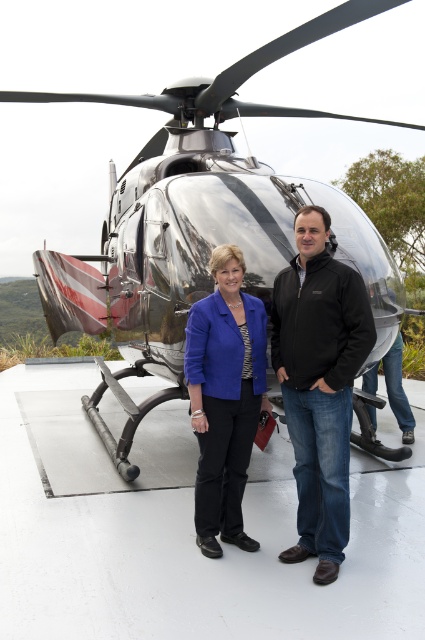
Question: Is black matte jacket at center positioned before matte blue blazer at center?

Choices:
 (A) no
 (B) yes

Answer: (B)

Question: Is black matte jacket at center closer to the viewer compared to matte blue blazer at center?

Choices:
 (A) no
 (B) yes

Answer: (B)

Question: Which point appears farthest from the camera in this image?

Choices:
 (A) 312,352
 (B) 240,385

Answer: (B)

Question: Is black matte jacket at center further to camera compared to matte blue blazer at center?

Choices:
 (A) no
 (B) yes

Answer: (A)

Question: Which object is farther from the camera taking this photo?

Choices:
 (A) black matte jacket at center
 (B) matte blue blazer at center

Answer: (B)